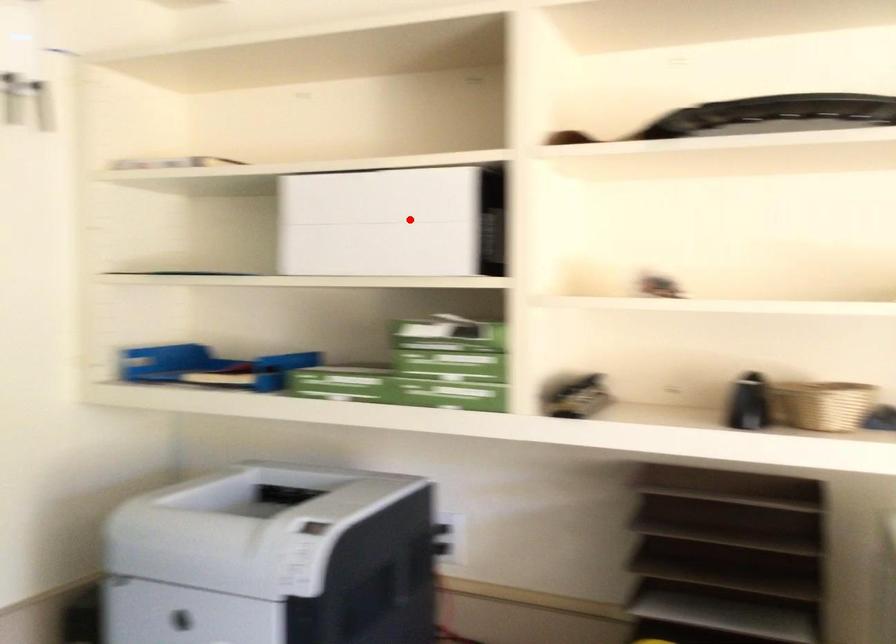
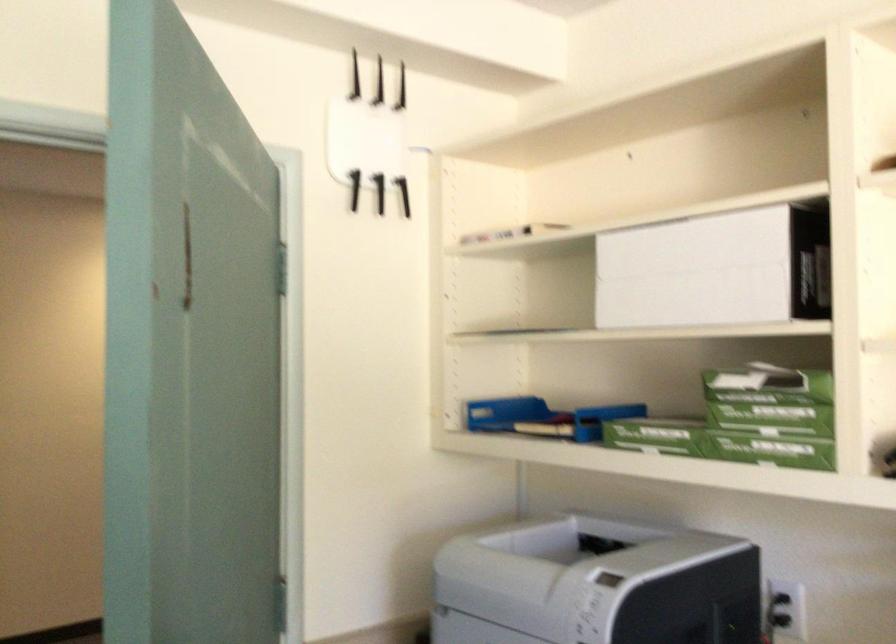
Find the pixel in the second image that matches the highlighted location in the first image.

(716, 269)